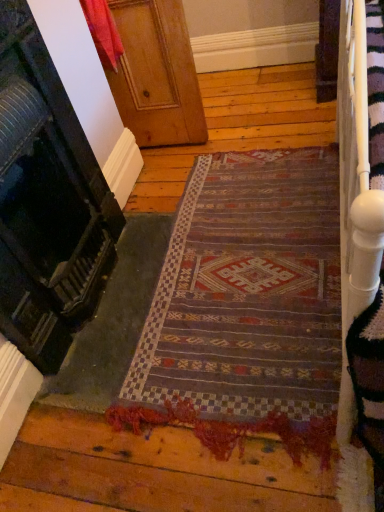
At what (x,y) coordinates should I click in order to perform the action: click on free space in front of wooden at left, which is the second door in bottom-to-top order. Please return your answer as a coordinate pair (x, y). Looking at the image, I should click on (187, 170).